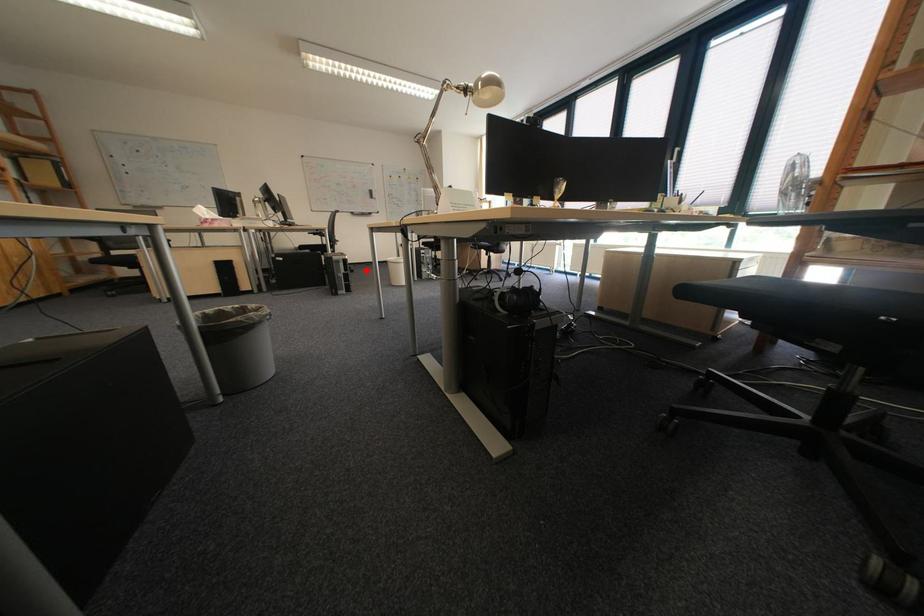
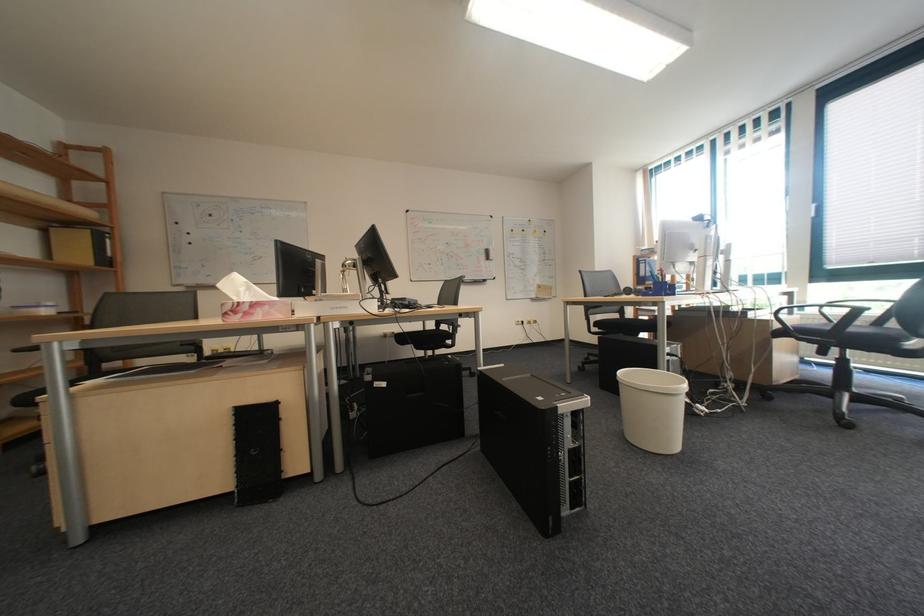
In the second image, find the point that corresponds to the highlighted location in the first image.

(487, 371)